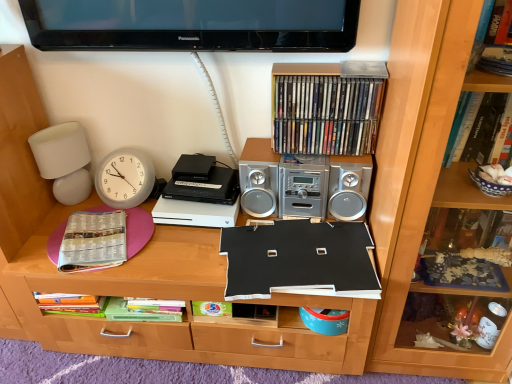
Question: Is silver metallic stereo at upper center not within white matte table lamp at left?

Choices:
 (A) yes
 (B) no

Answer: (A)

Question: Is silver metallic stereo at upper center closer to the viewer compared to white matte table lamp at left?

Choices:
 (A) no
 (B) yes

Answer: (B)

Question: Considering the relative sizes of silver metallic stereo at upper center and white matte table lamp at left in the image provided, is silver metallic stereo at upper center taller than white matte table lamp at left?

Choices:
 (A) yes
 (B) no

Answer: (B)

Question: Is white matte table lamp at left at the back of silver metallic stereo at upper center?

Choices:
 (A) no
 (B) yes

Answer: (A)

Question: Could you tell me if silver metallic stereo at upper center is facing white matte table lamp at left?

Choices:
 (A) yes
 (B) no

Answer: (B)

Question: Is silver metallic stereo at upper center not near white matte table lamp at left?

Choices:
 (A) no
 (B) yes

Answer: (A)

Question: From a real-world perspective, is black plastic cassette at center positioned under wooden bookcase at right based on gravity?

Choices:
 (A) yes
 (B) no

Answer: (A)

Question: Is black plastic cassette at center far from wooden bookcase at right?

Choices:
 (A) no
 (B) yes

Answer: (A)

Question: From a real-world perspective, is black plastic cassette at center physically above wooden bookcase at right?

Choices:
 (A) yes
 (B) no

Answer: (B)

Question: Is black plastic cassette at center positioned beyond the bounds of wooden bookcase at right?

Choices:
 (A) no
 (B) yes

Answer: (B)

Question: Is black plastic cassette at center positioned with its back to wooden bookcase at right?

Choices:
 (A) no
 (B) yes

Answer: (A)

Question: Can you confirm if black plastic cassette at center is taller than wooden bookcase at right?

Choices:
 (A) yes
 (B) no

Answer: (B)

Question: From a real-world perspective, is white paper at left, the 2th paperback book positioned from the right, over black matte paper at center, arranged as the 1th paperback book when viewed from the right?

Choices:
 (A) no
 (B) yes

Answer: (A)